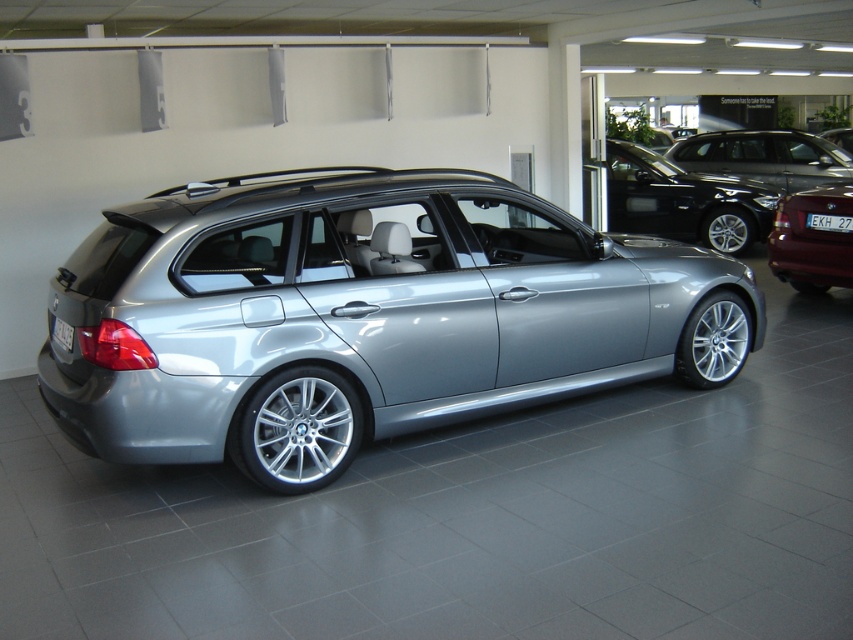
You are standing in a car showroom and want to take a closer look at the satin silver car at center. If you walk forward 2 meters, will you be able to touch the car?

The satin silver car at center is 3.74 meters away from you. After walking forward 2 meters, you will still be 1.74 meters away from the car, so you cannot touch it yet.

You are standing in a car showroom and looking at the silver BMW station wagon. There are two points marked on the car, one at point coordinates (271, 460) and the other at point coordinates (55, 336). Which of these two points is closer to your eyes?

Point (271, 460) is closer to the camera than point (55, 336).

You are standing in the car showroom and want to find the satin black sedan at upper center. According to the coordinates provided, where should you look relative to the silver BMW station wagon?

The satin black sedan at upper center is located at point coordinates 0.314 on the x axis and 0.803 on the y axis relative to the silver BMW station wagon.